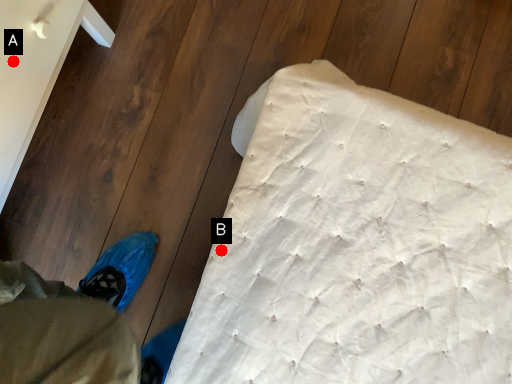
Question: Two points are circled on the image, labeled by A and B beside each circle. Which of the following is the farthest from the observer?

Choices:
 (A) A is further
 (B) B is further

Answer: (A)